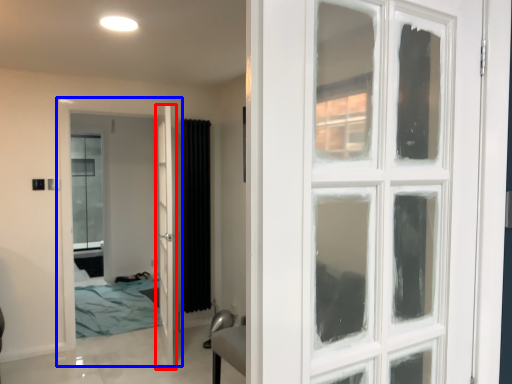
Question: Among these objects, which one is nearest to the camera, door (highlighted by a red box) or door (highlighted by a blue box)?

Choices:
 (A) door
 (B) door

Answer: (A)